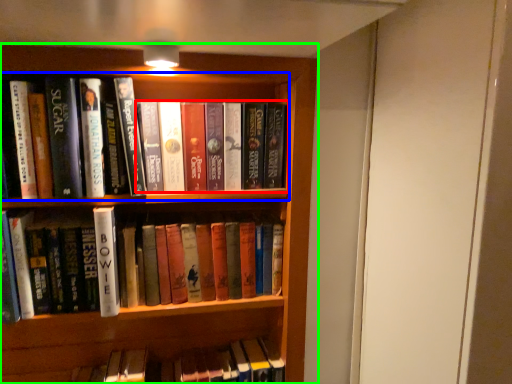
Question: Estimate the real-world distances between objects in this image. Which object is closer to book (highlighted by a red box), book (highlighted by a blue box) or bookcase (highlighted by a green box)?

Choices:
 (A) book
 (B) bookcase

Answer: (A)